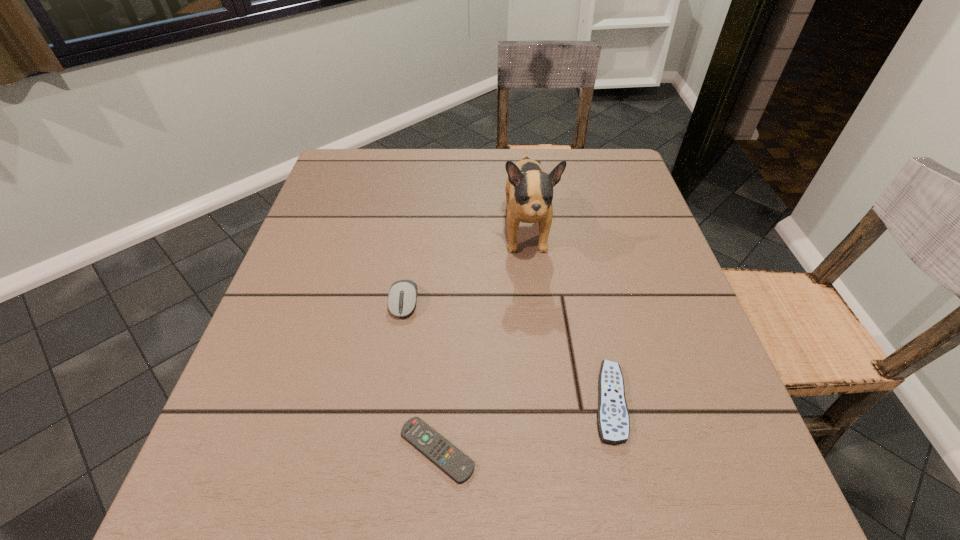
Locate an element on the screen. blank region between the tallest object and the rightmost object is located at coordinates (567, 317).

The height and width of the screenshot is (540, 960). Find the location of `empty location between the shorter remote control and the third tallest object`. empty location between the shorter remote control and the third tallest object is located at coordinates (523, 426).

Locate an element on the screen. empty space between the second tallest object and the rightmost object is located at coordinates tap(507, 352).

Where is `free space between the third object from left to right and the second farthest object`? The image size is (960, 540). free space between the third object from left to right and the second farthest object is located at coordinates (465, 267).

Find the location of `free area in between the puppy and the second tallest object`. free area in between the puppy and the second tallest object is located at coordinates (465, 267).

Locate an element on the screen. This screenshot has width=960, height=540. free space between the shortest object and the second farthest object is located at coordinates (x=420, y=376).

At what (x,y) coordinates should I click in order to perform the action: click on empty space between the third object from left to right and the rightmost object. Please return your answer as a coordinate pair (x, y). Looking at the image, I should click on (567, 317).

Find the location of a particular element. This screenshot has height=540, width=960. free space between the puppy and the computer equipment is located at coordinates (465, 267).

The height and width of the screenshot is (540, 960). I want to click on free space between the second farthest object and the third tallest object, so click(507, 352).

The height and width of the screenshot is (540, 960). Find the location of `object that ranks as the closest to the left remote control`. object that ranks as the closest to the left remote control is located at coordinates (613, 420).